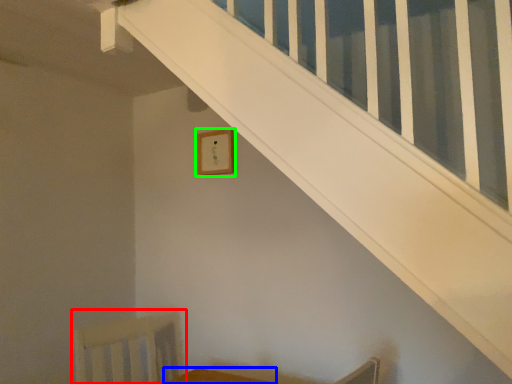
Question: Estimate the real-world distances between objects in this image. Which object is farther from swivel chair (highlighted by a red box), furniture (highlighted by a blue box) or picture frame (highlighted by a green box)?

Choices:
 (A) furniture
 (B) picture frame

Answer: (B)